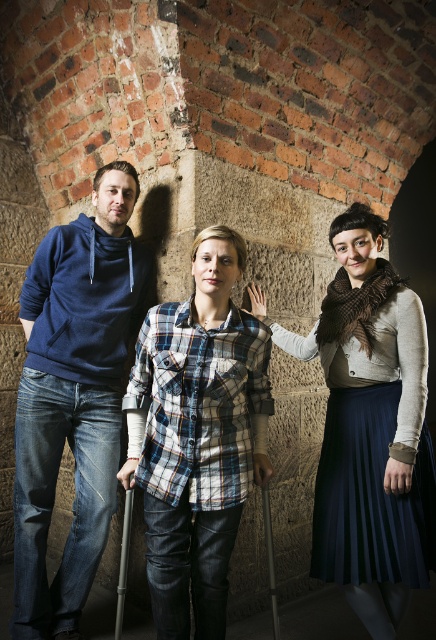
Question: Is plaid shirt at center wider than plaid cotton shirt at center?

Choices:
 (A) yes
 (B) no

Answer: (A)

Question: Estimate the real-world distances between objects in this image. Which object is farther from the matte blue hoodie at left?

Choices:
 (A) black plastic crutch at center
 (B) wooden crutch at lower center
 (C) plaid cotton shirt at center
 (D) brown textured scarf at center

Answer: (B)

Question: Can you confirm if matte blue hoodie at left is positioned to the right of wooden crutch at lower center?

Choices:
 (A) no
 (B) yes

Answer: (A)

Question: Is matte blue hoodie at left below plaid cotton shirt at center?

Choices:
 (A) yes
 (B) no

Answer: (B)

Question: Which point is closer to the camera taking this photo?

Choices:
 (A) (129, 520)
 (B) (395, 602)
 (C) (217, 484)

Answer: (C)

Question: Which is nearer to the plaid cotton shirt at center?

Choices:
 (A) wooden crutch at lower center
 (B) matte blue hoodie at left
 (C) plaid shirt at center
 (D) brown textured scarf at center

Answer: (A)